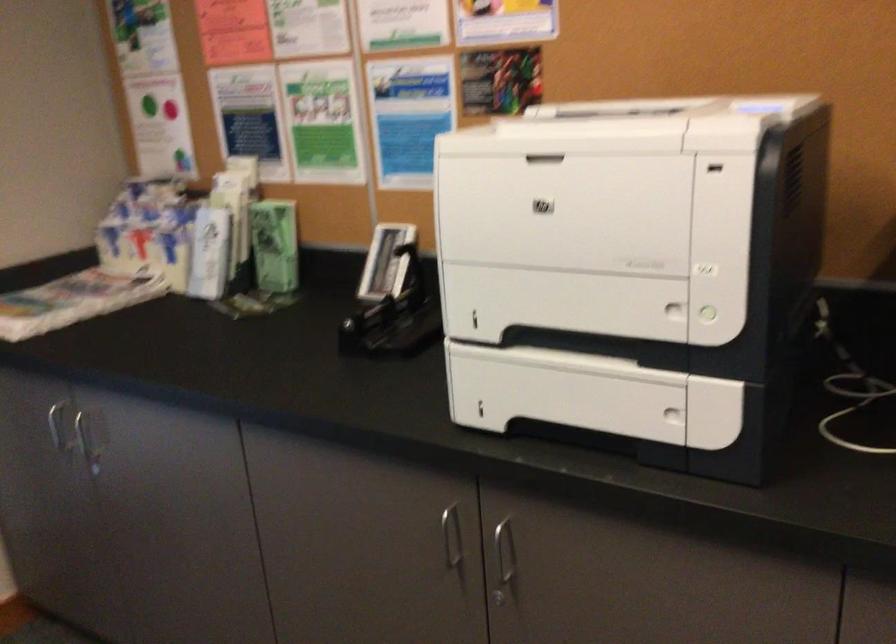
Image resolution: width=896 pixels, height=644 pixels. I want to click on green printer button, so click(x=709, y=314).